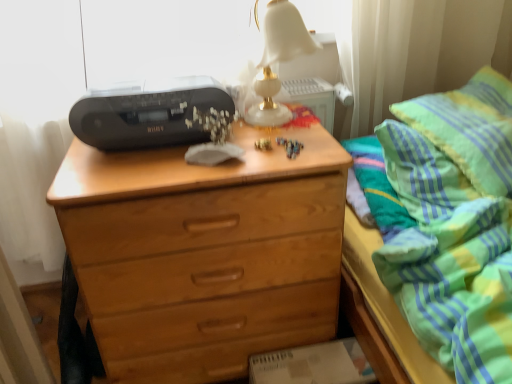
Find the location of a particular element. free space above light brown wood chest of drawers at center (from a real-world perspective) is located at coordinates coord(199,158).